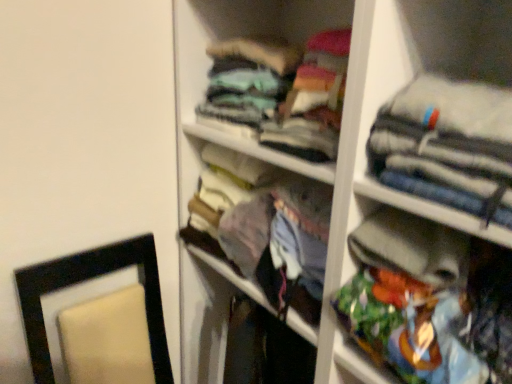
Question: In the image, is multicolored fabric bag at right, which is the first clothing from bottom to top, on the left side or the right side of teal fabric shirt at upper center, which is the third clothing from bottom to top?

Choices:
 (A) right
 (B) left

Answer: (A)

Question: From their relative heights in the image, would you say multicolored fabric bag at right, which is the first clothing from bottom to top, is taller or shorter than teal fabric shirt at upper center, which is the third clothing from bottom to top?

Choices:
 (A) tall
 (B) short

Answer: (A)

Question: Considering the real-world distances, which object is farthest from the teal fabric shirt at upper center, which is the third clothing from bottom to top?

Choices:
 (A) multicolored fabric bag at right, which is the first clothing from bottom to top
 (B) gray fabric jacket at upper right, which is the 2th clothing from top to bottom

Answer: (A)

Question: Which object is positioned farthest from the teal fabric shirt at upper center, which is the third clothing from bottom to top?

Choices:
 (A) multicolored fabric bag at right, which is the 3th clothing from top to bottom
 (B) gray fabric jacket at upper right, the second clothing positioned from the bottom

Answer: (A)